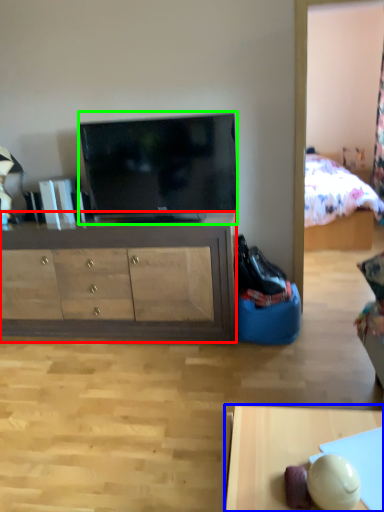
Question: Which object is positioned farthest from cabinetry (highlighted by a red box)? Select from desk (highlighted by a blue box) and television (highlighted by a green box).

Choices:
 (A) desk
 (B) television

Answer: (A)